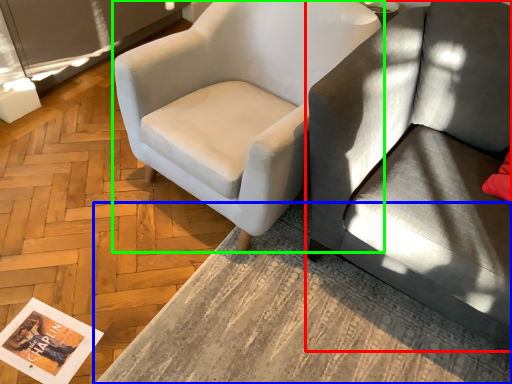
Question: Considering the real-world distances, which object is farthest from studio couch (highlighted by a red box)? table (highlighted by a blue box) or chair (highlighted by a green box)?

Choices:
 (A) table
 (B) chair

Answer: (A)